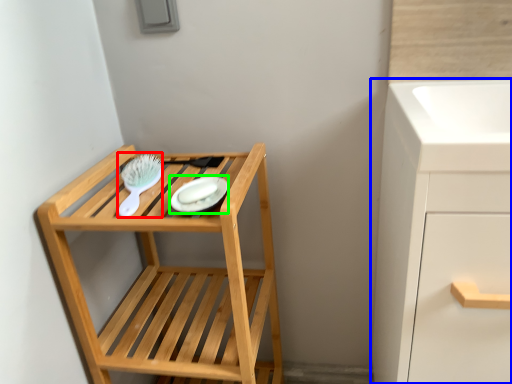
Question: Which object is positioned closest to brush (highlighted by a red box)? Select from bathroom cabinet (highlighted by a blue box) and platter (highlighted by a green box).

Choices:
 (A) bathroom cabinet
 (B) platter

Answer: (B)